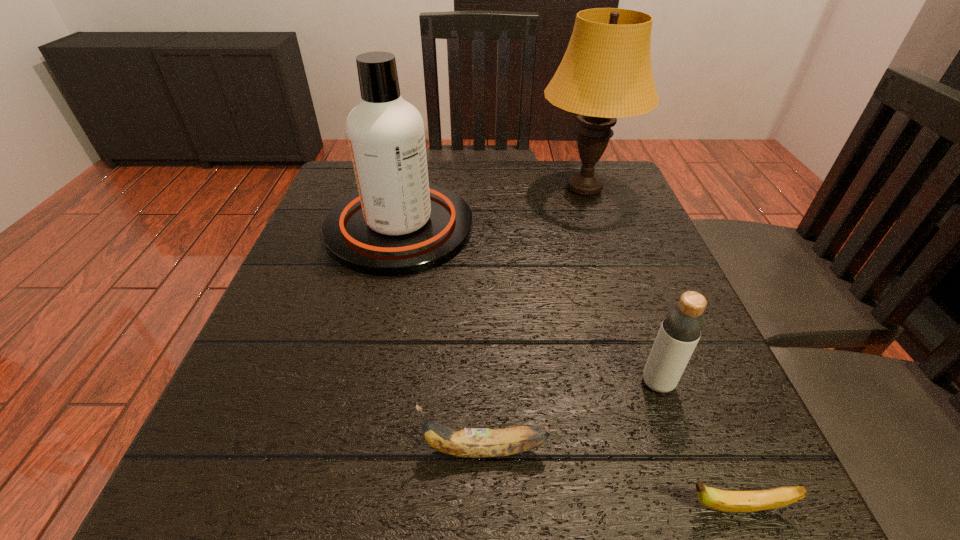
The width and height of the screenshot is (960, 540). I want to click on free space located 0.360m on the back of the third tallest object, so point(606,234).

Find the location of a particular element. The width and height of the screenshot is (960, 540). free spot located on the peel of the left banana is located at coordinates (203, 450).

The width and height of the screenshot is (960, 540). Identify the location of free spot located 0.230m on the peel of the left banana. (253, 450).

This screenshot has height=540, width=960. I want to click on free space located 0.300m on the peel of the left banana, so click(203, 450).

Find the location of a particular element. free point located at the stem of the nearest object is located at coordinates (x=552, y=508).

Where is `vacant position located 0.360m at the stem of the nearest object`? vacant position located 0.360m at the stem of the nearest object is located at coordinates (392, 508).

Where is `free location located 0.320m at the stem of the nearest object`? free location located 0.320m at the stem of the nearest object is located at coordinates (423, 508).

This screenshot has width=960, height=540. Find the location of `lampshade at the far edge`. lampshade at the far edge is located at coordinates (606, 73).

Identify the location of cleansing agent that is at the far edge. The width and height of the screenshot is (960, 540). (398, 224).

The image size is (960, 540). I want to click on object situated at the left edge, so click(x=398, y=224).